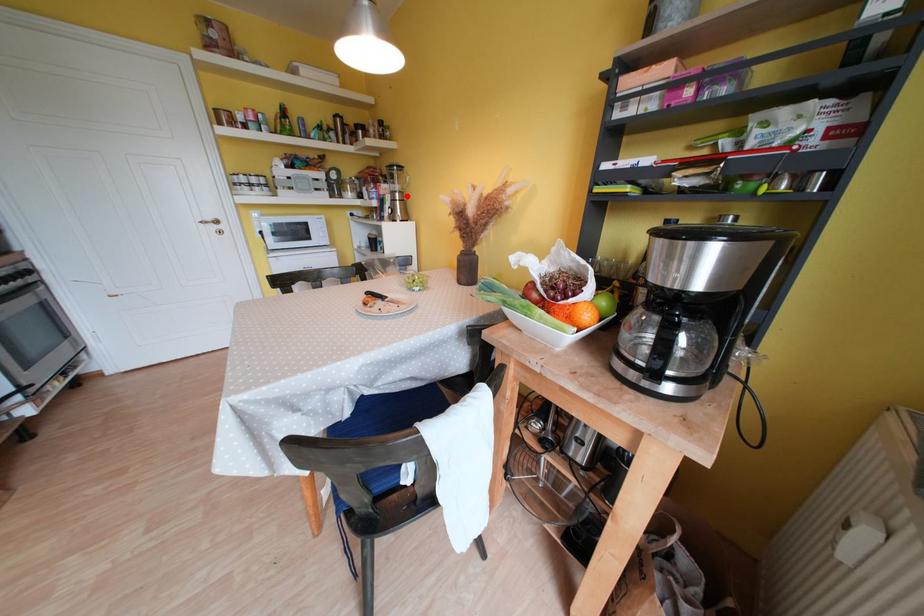
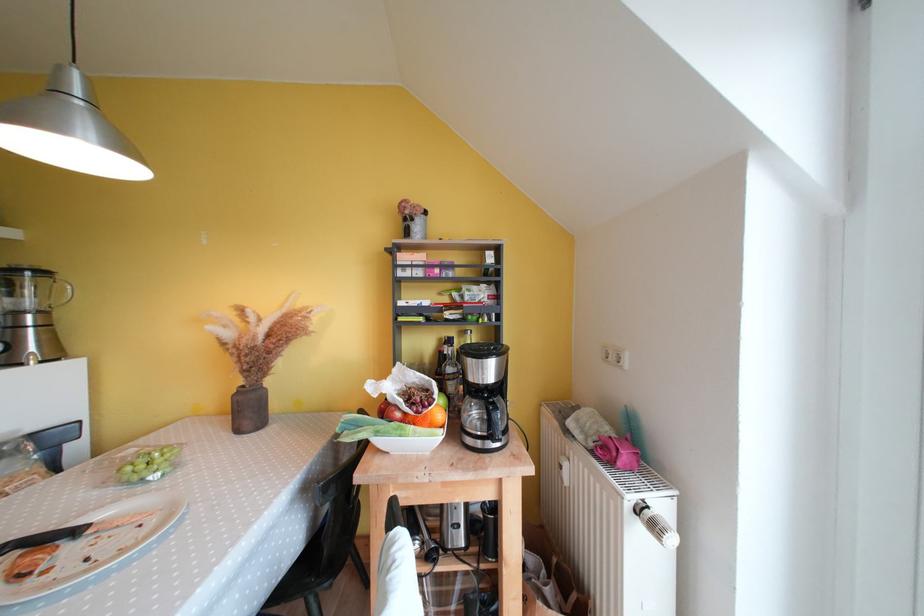
Where in the second image is the point corresponding to the highlighted location from the first image?

(49, 315)